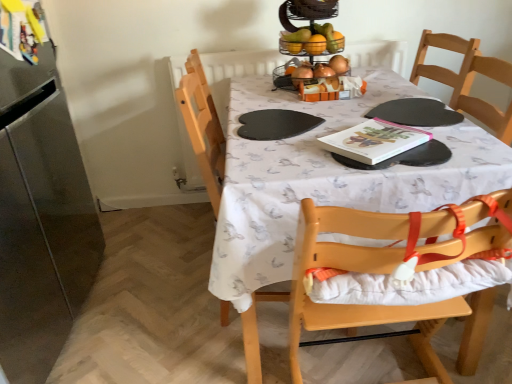
The image size is (512, 384). What are the coordinates of `free space that is to the left of white printed tablecloth at center` in the screenshot? It's located at (163, 290).